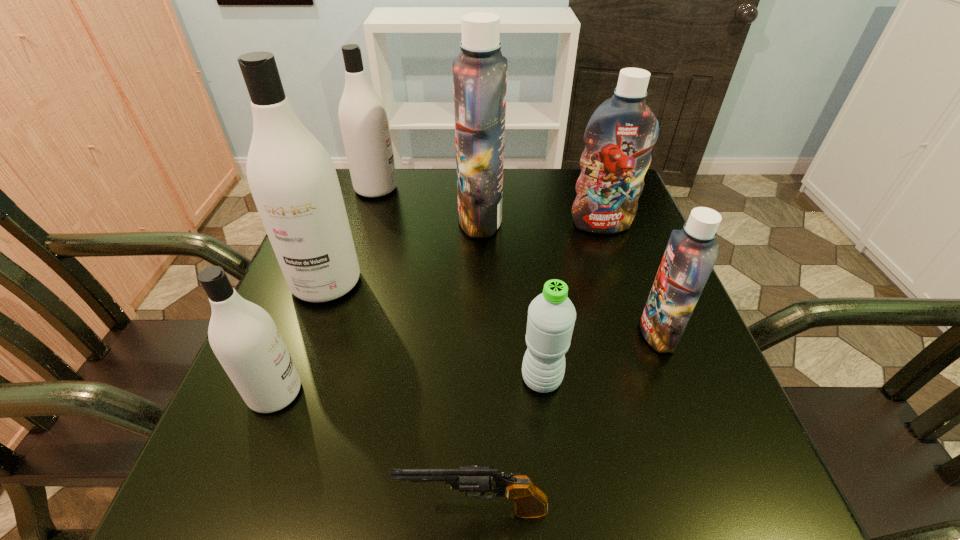
Find the location of `the leftmost blue shampoo`. the leftmost blue shampoo is located at coordinates (480, 70).

Where is `the third shampoo from right to left`? Image resolution: width=960 pixels, height=540 pixels. the third shampoo from right to left is located at coordinates (480, 70).

Find the location of a particular element. This screenshot has height=540, width=960. the second farthest white shampoo is located at coordinates (293, 181).

The height and width of the screenshot is (540, 960). In order to click on the third nearest shampoo in this screenshot , I will do `click(293, 181)`.

Locate an element on the screen. This screenshot has width=960, height=540. the second smallest white shampoo is located at coordinates (363, 118).

The width and height of the screenshot is (960, 540). What are the coordinates of `the second smallest blue shampoo` in the screenshot? It's located at (619, 137).

At what (x,y) coordinates should I click in order to perform the action: click on the smallest blue shampoo. Please return your answer as a coordinate pair (x, y). Looking at the image, I should click on (691, 253).

The image size is (960, 540). Find the location of `the second nearest shampoo`. the second nearest shampoo is located at coordinates (691, 253).

Where is `the smallest white shampoo`? Image resolution: width=960 pixels, height=540 pixels. the smallest white shampoo is located at coordinates (243, 336).

Locate an element on the screen. Image resolution: width=960 pixels, height=540 pixels. the nearest white shampoo is located at coordinates (243, 336).